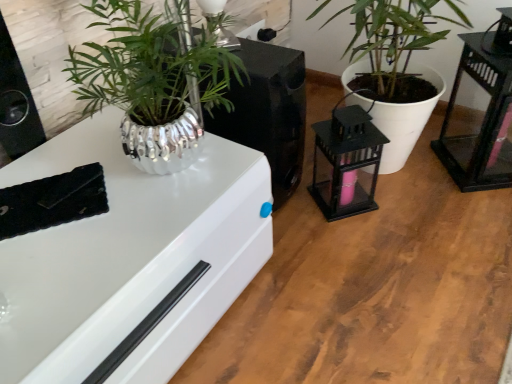
Question: From a real-world perspective, is black glass table at right positioned under white matte plant pot at center based on gravity?

Choices:
 (A) yes
 (B) no

Answer: (A)

Question: Is the depth of black glass table at right greater than that of white matte plant pot at center?

Choices:
 (A) yes
 (B) no

Answer: (A)

Question: Is white matte plant pot at center at the back of black glass table at right?

Choices:
 (A) no
 (B) yes

Answer: (B)

Question: Is black glass table at right thinner than white matte plant pot at center?

Choices:
 (A) no
 (B) yes

Answer: (B)

Question: Does black glass table at right have a greater width compared to white matte plant pot at center?

Choices:
 (A) yes
 (B) no

Answer: (B)

Question: Looking at the image, does black glass table at right seem bigger or smaller compared to metallic silver plant pot at upper left, which ranks as the 1th appliance in left-to-right order?

Choices:
 (A) small
 (B) big

Answer: (A)

Question: In terms of height, does black glass table at right look taller or shorter compared to metallic silver plant pot at upper left, which ranks as the 1th appliance in left-to-right order?

Choices:
 (A) short
 (B) tall

Answer: (B)

Question: Is black glass table at right wider or thinner than metallic silver plant pot at upper left, acting as the 2th appliance starting from the right?

Choices:
 (A) thin
 (B) wide

Answer: (A)

Question: From a real-world perspective, is black glass table at right positioned above or below metallic silver plant pot at upper left, which ranks as the 1th appliance in left-to-right order?

Choices:
 (A) below
 (B) above

Answer: (B)

Question: Is black metal lantern at center-right, the first appliance in the right-to-left sequence, wider or thinner than white matte plant pot at center?

Choices:
 (A) wide
 (B) thin

Answer: (B)

Question: From a real-world perspective, is black metal lantern at center-right, acting as the 2th appliance starting from the left, above or below white matte plant pot at center?

Choices:
 (A) above
 (B) below

Answer: (B)

Question: Choose the correct answer: Is black metal lantern at center-right, acting as the 2th appliance starting from the left, inside white matte plant pot at center or outside it?

Choices:
 (A) inside
 (B) outside

Answer: (B)

Question: Considering the positions of black metal lantern at center-right, the first appliance in the right-to-left sequence, and white matte plant pot at center in the image, is black metal lantern at center-right, the first appliance in the right-to-left sequence, bigger or smaller than white matte plant pot at center?

Choices:
 (A) small
 (B) big

Answer: (A)

Question: In the image, is black glass table at right on the left side or the right side of white matte plant pot at center?

Choices:
 (A) right
 (B) left

Answer: (A)

Question: Is black glass table at right inside or outside of white matte plant pot at center?

Choices:
 (A) outside
 (B) inside

Answer: (A)